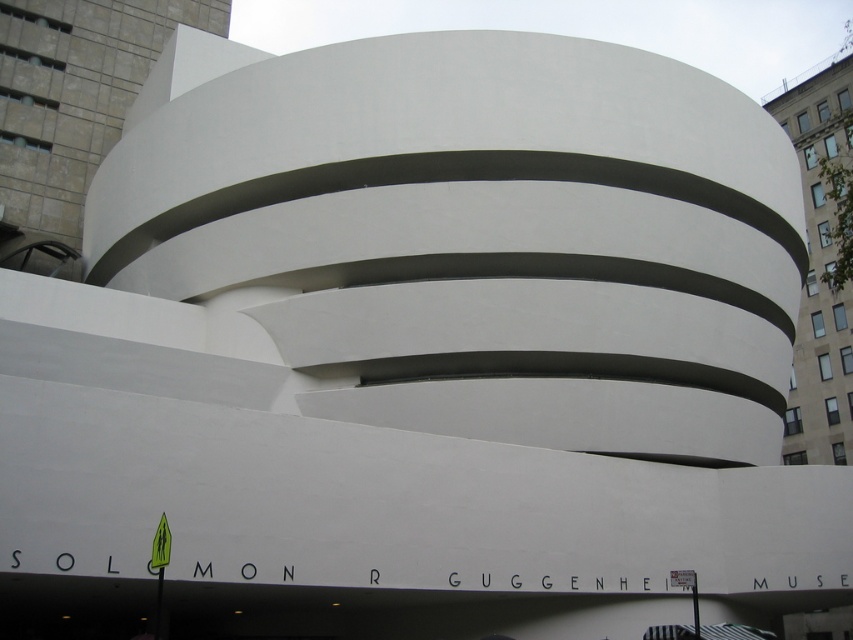
Who is lower down, white smooth concrete at upper left or white smooth building at upper right?

white smooth building at upper right

Where is `white smooth concrete at upper left`? Image resolution: width=853 pixels, height=640 pixels. white smooth concrete at upper left is located at coordinates (73, 109).

Find the location of `white smooth concrete at upper left`. white smooth concrete at upper left is located at coordinates (73, 109).